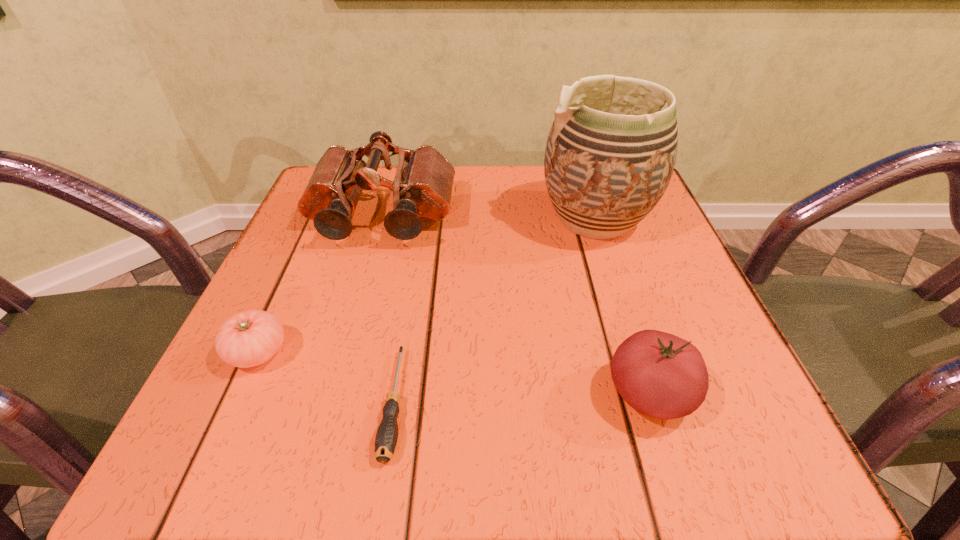
Where is `vacant space located 0.170m on the back of the second shortest object`? This screenshot has width=960, height=540. vacant space located 0.170m on the back of the second shortest object is located at coordinates (300, 258).

At what (x,y) coordinates should I click in order to perform the action: click on free space located 0.210m on the right of the shortest object. Please return your answer as a coordinate pair (x, y). Looking at the image, I should click on (562, 403).

The image size is (960, 540). Identify the location of pottery located in the far edge section of the desktop. (610, 154).

This screenshot has height=540, width=960. I want to click on binoculars positioned at the far edge, so click(422, 187).

At what (x,y) coordinates should I click in order to perform the action: click on tomato at the near edge. Please return your answer as a coordinate pair (x, y). Looking at the image, I should click on (660, 375).

The height and width of the screenshot is (540, 960). I want to click on screwdriver situated at the near edge, so click(386, 438).

Where is `binoculars located in the left edge section of the desktop`? This screenshot has width=960, height=540. binoculars located in the left edge section of the desktop is located at coordinates [x=422, y=187].

Find the location of a particular element. tomato at the left edge is located at coordinates (250, 338).

Locate an element on the screen. This screenshot has height=540, width=960. pottery that is at the right edge is located at coordinates (610, 154).

Find the location of a particular element. Image resolution: width=960 pixels, height=540 pixels. tomato present at the right edge is located at coordinates (660, 375).